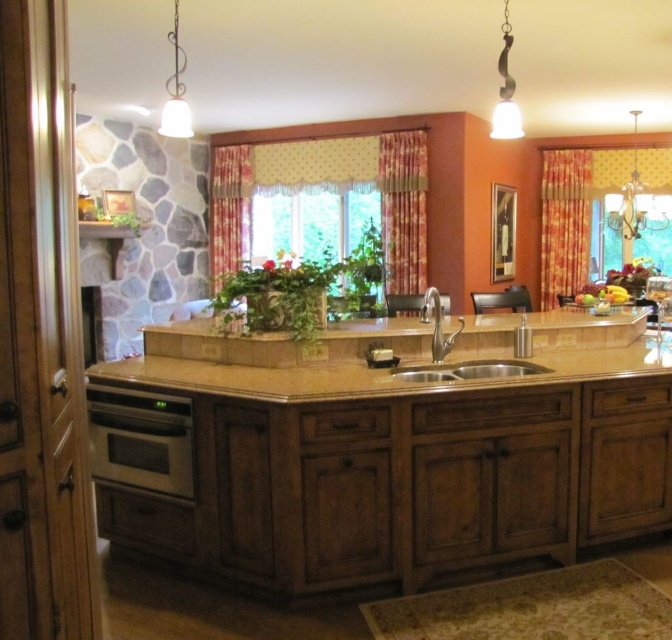
Who is more forward, (x=196, y=374) or (x=390, y=268)?

Point (x=196, y=374) is more forward.

Is brown polished wood counter top at center smaller than floral fabric curtain at center?

Actually, brown polished wood counter top at center might be larger than floral fabric curtain at center.

Does point (536, 508) come closer to viewer compared to point (386, 198)?

That is True.

The height and width of the screenshot is (640, 672). Find the location of `brown polished wood counter top at center`. brown polished wood counter top at center is located at coordinates click(x=396, y=452).

Does brown polished wood counter top at center have a smaller size compared to yellow-orange floral fabric curtain at right?

Incorrect, brown polished wood counter top at center is not smaller in size than yellow-orange floral fabric curtain at right.

Can you confirm if brown polished wood counter top at center is positioned above yellow-orange floral fabric curtain at right?

No, brown polished wood counter top at center is not above yellow-orange floral fabric curtain at right.

Which is in front, point (345, 396) or point (575, 282)?

Point (345, 396) is more forward.

At what (x,y) coordinates should I click in order to perform the action: click on brown polished wood counter top at center. Please return your answer as a coordinate pair (x, y). This screenshot has height=640, width=672. Looking at the image, I should click on (396, 452).

Can you confirm if yellow-orange floral fabric curtain at right is taller than polished stainless steel faucet at center?

Yes, yellow-orange floral fabric curtain at right is taller than polished stainless steel faucet at center.

Where is `yellow-orange floral fabric curtain at right`? yellow-orange floral fabric curtain at right is located at coordinates (564, 221).

Image resolution: width=672 pixels, height=640 pixels. I want to click on yellow-orange floral fabric curtain at right, so click(x=564, y=221).